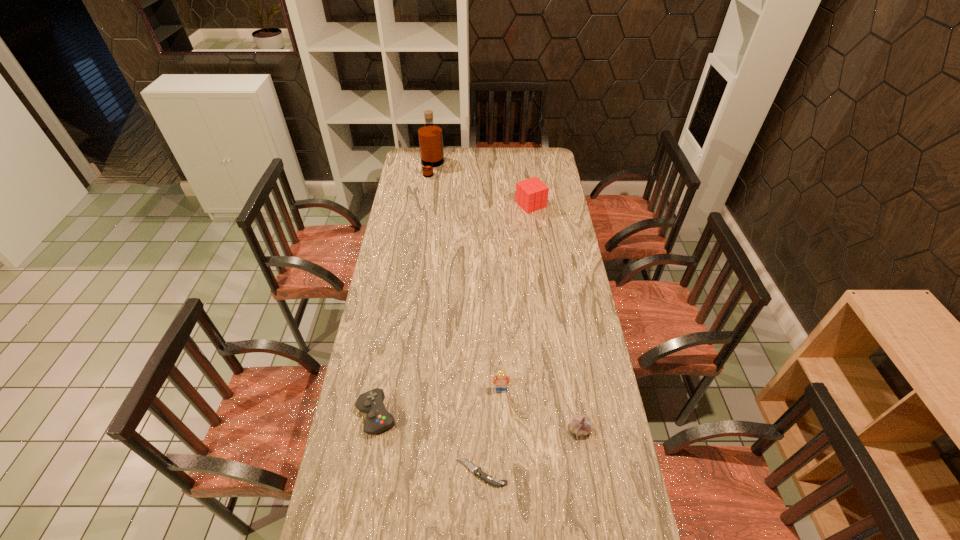
Where is `the farthest object`? the farthest object is located at coordinates pyautogui.click(x=430, y=135).

Where is `liquor`? liquor is located at coordinates pyautogui.click(x=430, y=135).

The width and height of the screenshot is (960, 540). In order to click on the fifth nearest object in this screenshot , I will do 531,194.

Where is `the fourth nearest object`? The image size is (960, 540). the fourth nearest object is located at coordinates (500, 382).

Where is `the third shortest object`? The height and width of the screenshot is (540, 960). the third shortest object is located at coordinates coord(581,425).

You are a GUI agent. You are given a task and a screenshot of the screen. Output one action in this format:
    pyautogui.click(x=<x>, y=<y>)
    Task: Click on the fifth tallest object
    
    Given the screenshot: What is the action you would take?
    pyautogui.click(x=378, y=419)

Identify the location of the shortest object. (489, 479).

You are a GUI agent. You are given a task and a screenshot of the screen. Output one action in this format:
    pyautogui.click(x=<x>, y=<y>)
    Task: Click on the pocketknife
    
    Given the screenshot: What is the action you would take?
    pyautogui.click(x=489, y=479)

Identify the location of vacant space located on the front label of the tallest object. The width and height of the screenshot is (960, 540). (x=496, y=166).

Locate an element on the screen. free location located 0.310m on the front of the second farthest object is located at coordinates point(538,256).